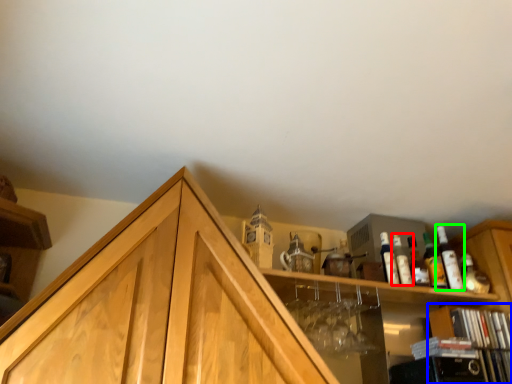
Question: Considering the real-world distances, which object is closest to bottle (highlighted by a red box)? cabinetry (highlighted by a blue box) or bottle (highlighted by a green box).

Choices:
 (A) cabinetry
 (B) bottle

Answer: (B)